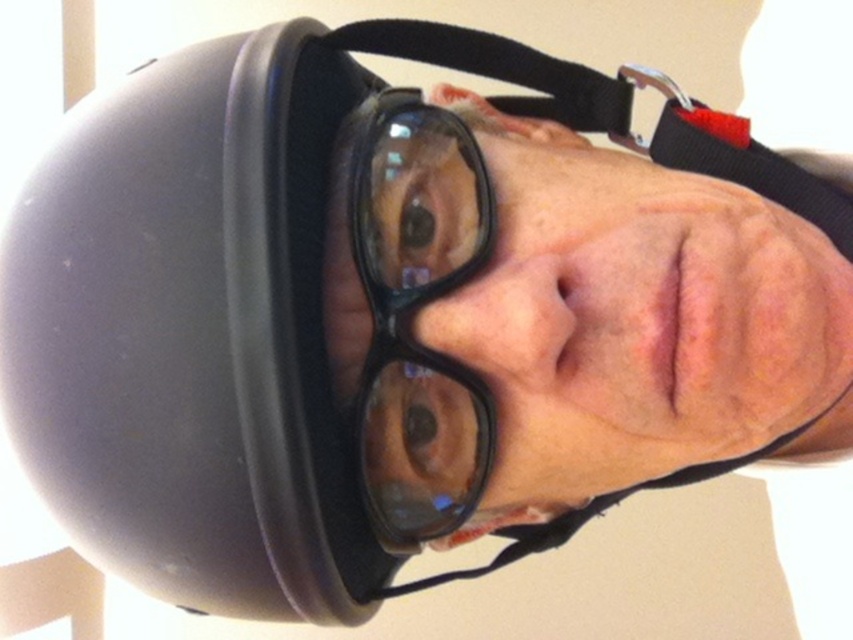
Between black plastic glasses at center and black plastic strap at upper center, which one has less height?

With less height is black plastic strap at upper center.

Is black plastic glasses at center positioned behind black plastic strap at upper center?

No.

Describe the element at coordinates (413, 314) in the screenshot. I see `black plastic glasses at center` at that location.

Find the location of a particular element. black plastic glasses at center is located at coordinates (413, 314).